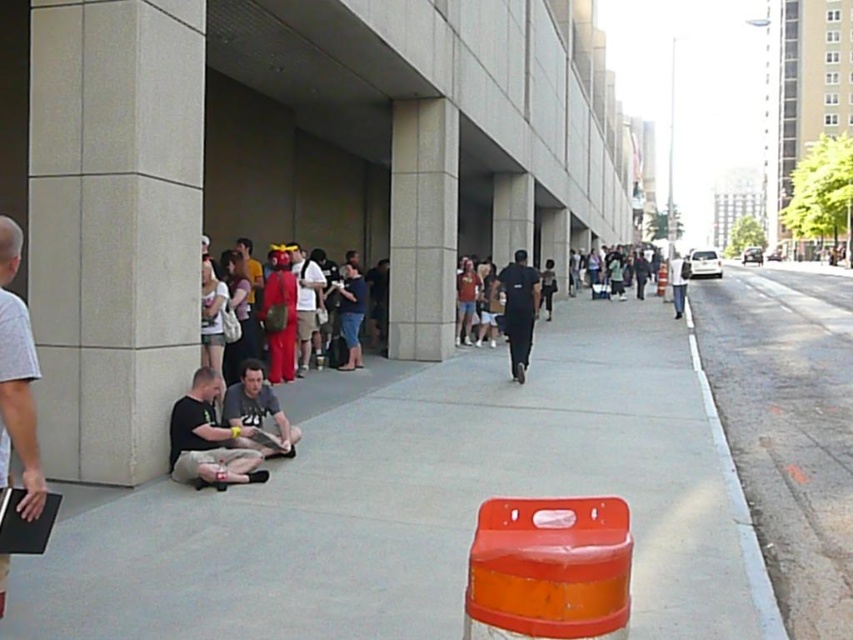
Question: Is gray concrete curb at lower right positioned before matte red shirt at center?

Choices:
 (A) no
 (B) yes

Answer: (B)

Question: Which point appears closest to the camera in this image?

Choices:
 (A) (76, 205)
 (B) (683, 307)
 (C) (341, 435)

Answer: (A)

Question: Can you confirm if beige concrete pillar at left is thinner than matte gray shirt at left?

Choices:
 (A) no
 (B) yes

Answer: (A)

Question: Estimate the real-world distances between objects in this image. Which object is farther from the black t-shirt at lower left?

Choices:
 (A) gray concrete sidewalk at center
 (B) dark gray fabric shirt at lower left
 (C) beige stone pillar at center
 (D) matte gray shirt at left

Answer: (C)

Question: Can you confirm if beige concrete pillar at left is thinner than dark blue shirt at center?

Choices:
 (A) yes
 (B) no

Answer: (B)

Question: Based on their relative distances, which object is nearer to the matte red shirt at center?

Choices:
 (A) gray concrete curb at lower right
 (B) matte gray shirt at left
 (C) red costume at center
 (D) dark gray fabric shirt at lower left

Answer: (C)